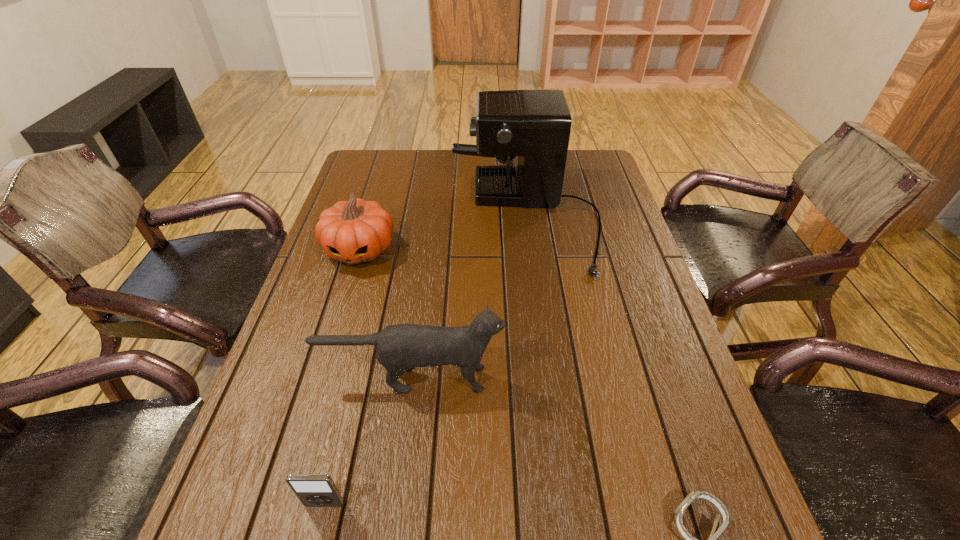
Image resolution: width=960 pixels, height=540 pixels. What are the coordinates of `the tallest object` in the screenshot? It's located at (535, 124).

At what (x,y) coordinates should I click in order to perform the action: click on cat. Please return your answer as a coordinate pair (x, y). This screenshot has height=540, width=960. Looking at the image, I should click on (400, 348).

Identify the location of the third nearest object. pos(400,348).

Where is `the third shortest object`? Image resolution: width=960 pixels, height=540 pixels. the third shortest object is located at coordinates (355, 231).

Locate an element on the screen. The width and height of the screenshot is (960, 540). iPod is located at coordinates (313, 490).

Where is `free space located on the front-facing side of the coffee maker`? free space located on the front-facing side of the coffee maker is located at coordinates (396, 219).

This screenshot has height=540, width=960. In order to click on free point located 0.140m on the front-facing side of the coffee maker in this screenshot , I will do `click(406, 219)`.

Where is `free spot located 0.150m on the front-facing side of the coffee maker`? free spot located 0.150m on the front-facing side of the coffee maker is located at coordinates (402, 219).

In order to click on free point located 0.280m on the front-facing side of the fourth shortest object in this screenshot , I will do `click(632, 379)`.

The height and width of the screenshot is (540, 960). I want to click on vacant space located on the face of the pumpkin, so click(327, 358).